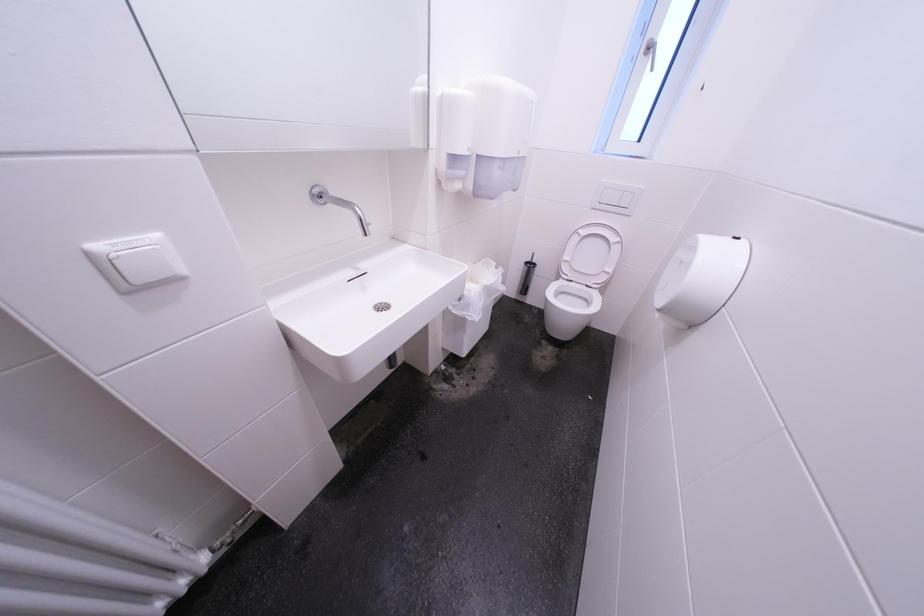
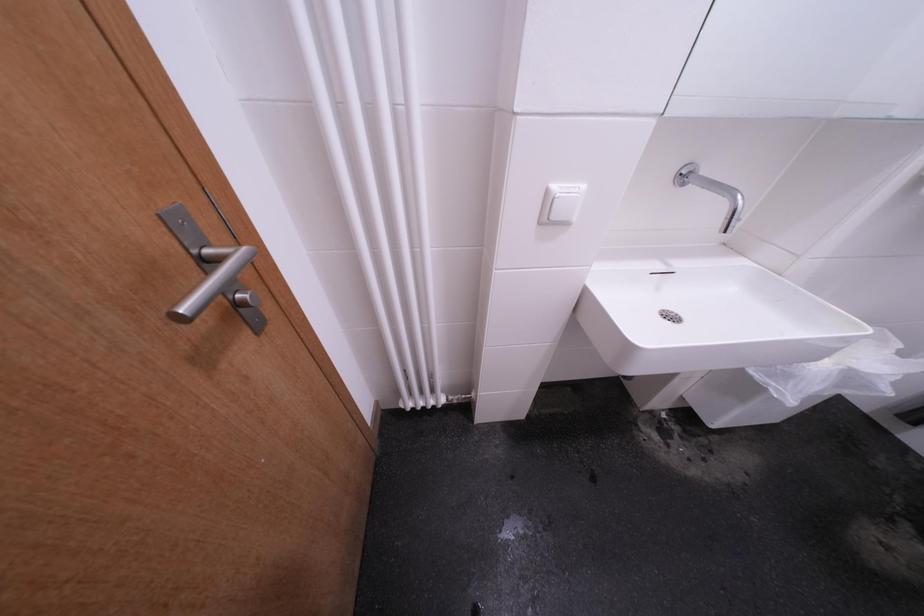
Question: The images are taken continuously from a first-person perspective. In which direction is your viewpoint rotating?

Choices:
 (A) Left
 (B) Right
 (C) Up
 (D) Down

Answer: (A)